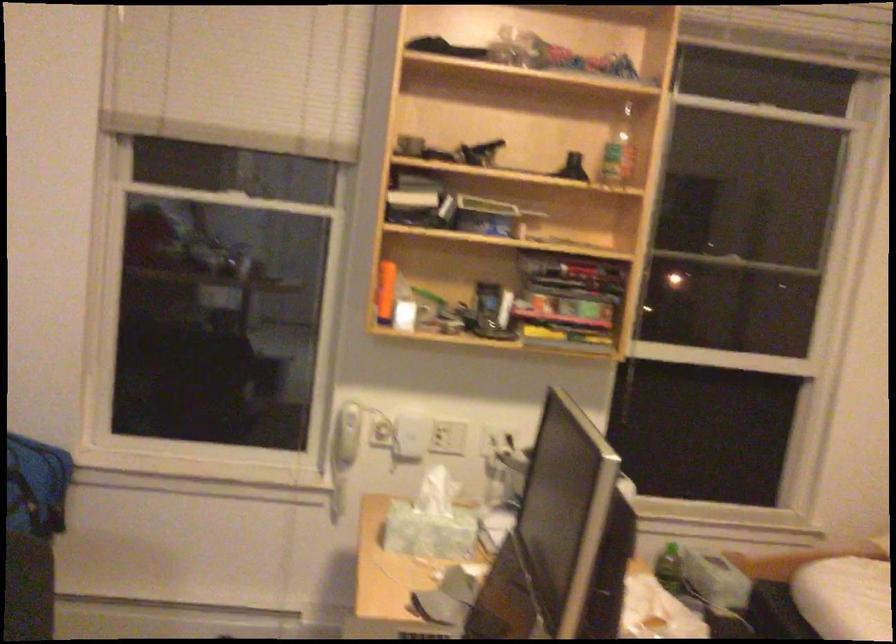
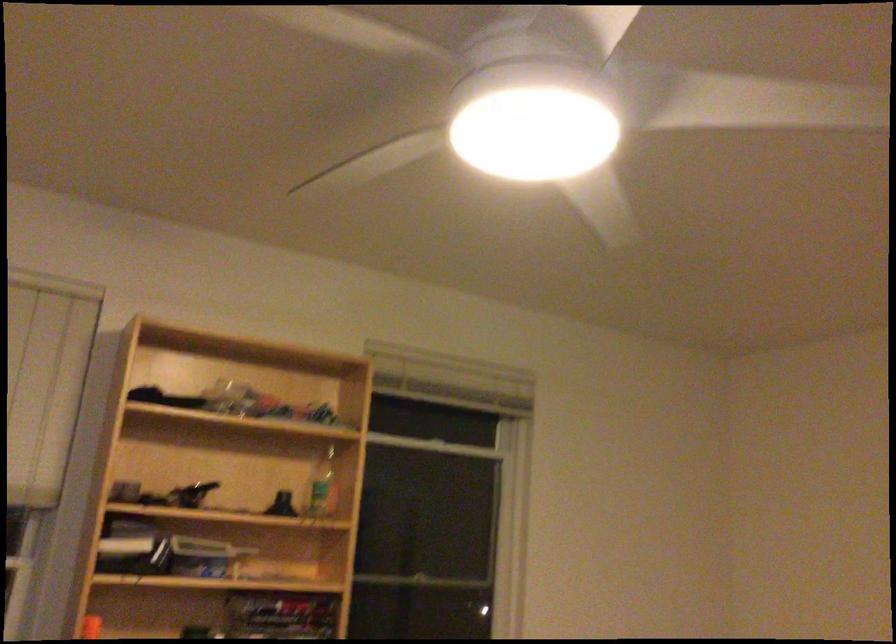
In the second image, find the point that corresponds to (x=565, y=276) in the first image.

(281, 614)